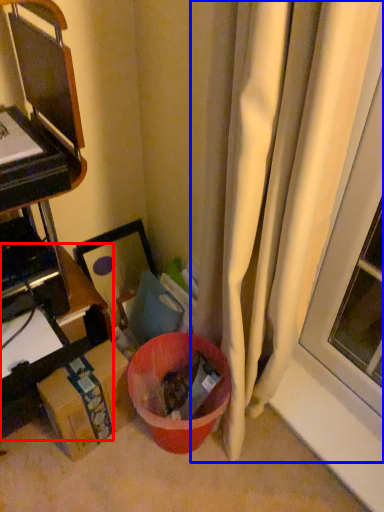
Question: Among these objects, which one is farthest to the camera, furniture (highlighted by a red box) or curtain (highlighted by a blue box)?

Choices:
 (A) furniture
 (B) curtain

Answer: (A)